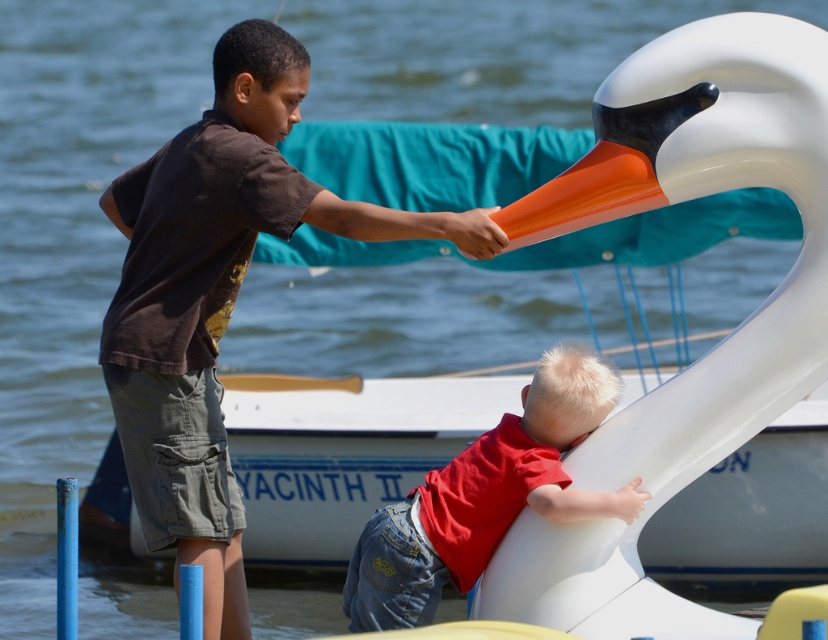
You are a photographer trying to capture both the white glossy swan at upper right and the red matte shirt at lower center in a single frame. Given their sizes, which object should you focus on to ensure both are visible without cropping?

Since the white glossy swan at upper right is bigger than the red matte shirt at lower center, you should focus on the white glossy swan at upper right to accommodate its larger size in the frame.

You are a parent supervising children at the water park. You notice the white glossy swan at upper right and the brown cotton shirt at upper left. Which object is closer to the front of the image?

The white glossy swan at upper right is positioned over the brown cotton shirt at upper left, meaning it is closer to the front of the image.